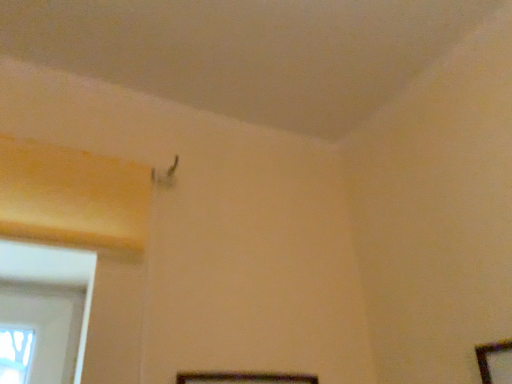
Question: Is the depth of wooden picture frame at lower right, the second picture frame positioned from the left, greater than that of wooden picture frame at lower center, which appears as the first picture frame when viewed from the left?

Choices:
 (A) no
 (B) yes

Answer: (A)

Question: From a real-world perspective, is wooden picture frame at lower right, the 1th picture frame from the right, physically above wooden picture frame at lower center, which appears as the first picture frame when viewed from the left?

Choices:
 (A) yes
 (B) no

Answer: (A)

Question: From the image's perspective, does wooden picture frame at lower right, the second picture frame positioned from the left, appear higher than wooden picture frame at lower center, which appears as the first picture frame when viewed from the left?

Choices:
 (A) no
 (B) yes

Answer: (B)

Question: Can you confirm if wooden picture frame at lower right, the 1th picture frame from the right, is wider than wooden picture frame at lower center, the second picture frame from the right?

Choices:
 (A) no
 (B) yes

Answer: (B)

Question: Is wooden picture frame at lower right, the 1th picture frame from the right, outside wooden picture frame at lower center, the second picture frame from the right?

Choices:
 (A) yes
 (B) no

Answer: (A)

Question: Does wooden picture frame at lower right, the second picture frame positioned from the left, have a smaller size compared to wooden picture frame at lower center, which appears as the first picture frame when viewed from the left?

Choices:
 (A) no
 (B) yes

Answer: (A)

Question: Is wooden picture frame at lower center, which appears as the first picture frame when viewed from the left, at the right side of wooden picture frame at lower right, the 1th picture frame from the right?

Choices:
 (A) yes
 (B) no

Answer: (B)

Question: Can you confirm if wooden picture frame at lower center, which appears as the first picture frame when viewed from the left, is shorter than wooden picture frame at lower right, the 1th picture frame from the right?

Choices:
 (A) no
 (B) yes

Answer: (B)

Question: Is wooden picture frame at lower center, the second picture frame from the right, taller than wooden picture frame at lower right, the 1th picture frame from the right?

Choices:
 (A) no
 (B) yes

Answer: (A)

Question: Considering the relative positions of wooden picture frame at lower center, which appears as the first picture frame when viewed from the left, and wooden picture frame at lower right, the 1th picture frame from the right, in the image provided, is wooden picture frame at lower center, which appears as the first picture frame when viewed from the left, behind wooden picture frame at lower right, the 1th picture frame from the right,?

Choices:
 (A) yes
 (B) no

Answer: (A)

Question: From the image's perspective, is wooden picture frame at lower center, the second picture frame from the right, on top of wooden picture frame at lower right, the 1th picture frame from the right?

Choices:
 (A) no
 (B) yes

Answer: (A)

Question: Would you say wooden picture frame at lower right, the 1th picture frame from the right, is part of wooden picture frame at lower center, the second picture frame from the right,'s contents?

Choices:
 (A) yes
 (B) no

Answer: (B)

Question: Visually, is wooden picture frame at lower center, which appears as the first picture frame when viewed from the left, positioned to the left or to the right of wooden picture frame at lower right, the second picture frame positioned from the left?

Choices:
 (A) right
 (B) left

Answer: (B)